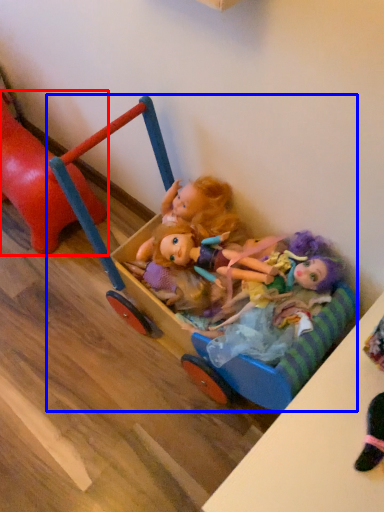
Question: Which object is closer to the camera taking this photo, toy (highlighted by a red box) or toy (highlighted by a blue box)?

Choices:
 (A) toy
 (B) toy

Answer: (B)